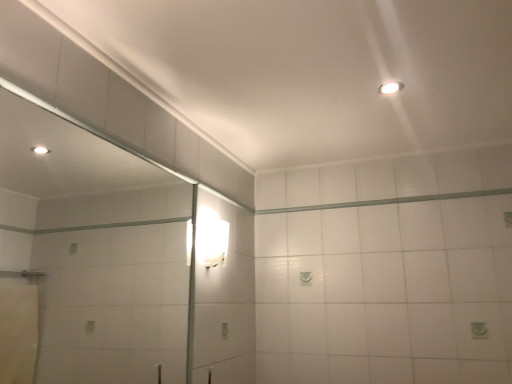
Question: Is white glossy wall sconce at upper center, the first light fixture from the back, further to camera compared to clear glass mirror at left?

Choices:
 (A) yes
 (B) no

Answer: (A)

Question: Does white glossy wall sconce at upper center, the 1th light fixture ordered from the bottom, turn towards clear glass mirror at left?

Choices:
 (A) no
 (B) yes

Answer: (A)

Question: Does white glossy wall sconce at upper center, which is counted as the second light fixture, starting from the top, lie in front of clear glass mirror at left?

Choices:
 (A) yes
 (B) no

Answer: (B)

Question: From a real-world perspective, is white glossy wall sconce at upper center, which is counted as the second light fixture, starting from the front, on top of clear glass mirror at left?

Choices:
 (A) yes
 (B) no

Answer: (A)

Question: From the image's perspective, is white glossy wall sconce at upper center, which is counted as the second light fixture, starting from the front, below clear glass mirror at left?

Choices:
 (A) no
 (B) yes

Answer: (A)

Question: Is white glossy wall sconce at upper center, the second light fixture viewed from the right, placed right next to clear glass mirror at left?

Choices:
 (A) no
 (B) yes

Answer: (A)

Question: Are white glossy wall sconce at upper center, which is counted as the second light fixture, starting from the front, and white glossy beam at upper center making contact?

Choices:
 (A) no
 (B) yes

Answer: (A)

Question: Can you confirm if white glossy wall sconce at upper center, the 1th light fixture ordered from the bottom, is wider than white glossy beam at upper center?

Choices:
 (A) yes
 (B) no

Answer: (A)

Question: Considering the relative sizes of white glossy wall sconce at upper center, which is counted as the second light fixture, starting from the front, and white glossy beam at upper center in the image provided, is white glossy wall sconce at upper center, which is counted as the second light fixture, starting from the front, smaller than white glossy beam at upper center?

Choices:
 (A) no
 (B) yes

Answer: (A)

Question: Is white glossy wall sconce at upper center, which is counted as the second light fixture, starting from the top, surrounding white glossy beam at upper center?

Choices:
 (A) no
 (B) yes

Answer: (A)

Question: Does white glossy wall sconce at upper center, which is counted as the 1th light fixture, starting from the left, have a greater height compared to white glossy beam at upper center?

Choices:
 (A) yes
 (B) no

Answer: (A)

Question: Would you say white glossy wall sconce at upper center, which is counted as the 1th light fixture, starting from the left, is outside white glossy beam at upper center?

Choices:
 (A) yes
 (B) no

Answer: (A)

Question: Is white glossy beam at upper center taller than white glossy wall sconce at upper center, which is counted as the 1th light fixture, starting from the left?

Choices:
 (A) yes
 (B) no

Answer: (B)